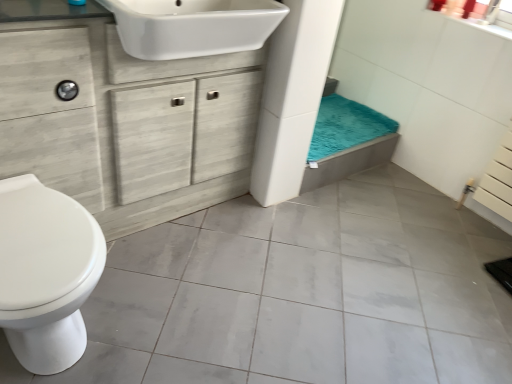
Question: Considering the positions of white glossy sink at upper center and teal plush bath towel at center in the image, is white glossy sink at upper center bigger or smaller than teal plush bath towel at center?

Choices:
 (A) small
 (B) big

Answer: (B)

Question: Is point (118, 28) positioned closer to the camera than point (310, 155)?

Choices:
 (A) farther
 (B) closer

Answer: (B)

Question: Which is nearer to the white glossy toilet at left?

Choices:
 (A) white wood cabinet at center
 (B) teal plush bath towel at center
 (C) white glossy sink at upper center

Answer: (A)

Question: Considering the real-world distances, which object is closest to the teal plush bath towel at center?

Choices:
 (A) white glossy toilet at left
 (B) white glossy sink at upper center
 (C) white wood cabinet at center

Answer: (C)